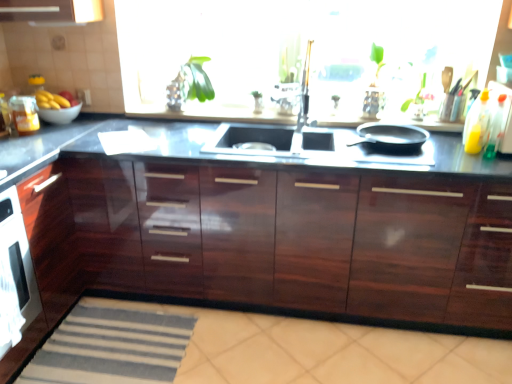
Find the location of a particular element. The height and width of the screenshot is (384, 512). free space that is to the left of translucent plastic bottle at right, positioned as the second bottle in front-to-back order is located at coordinates (452, 148).